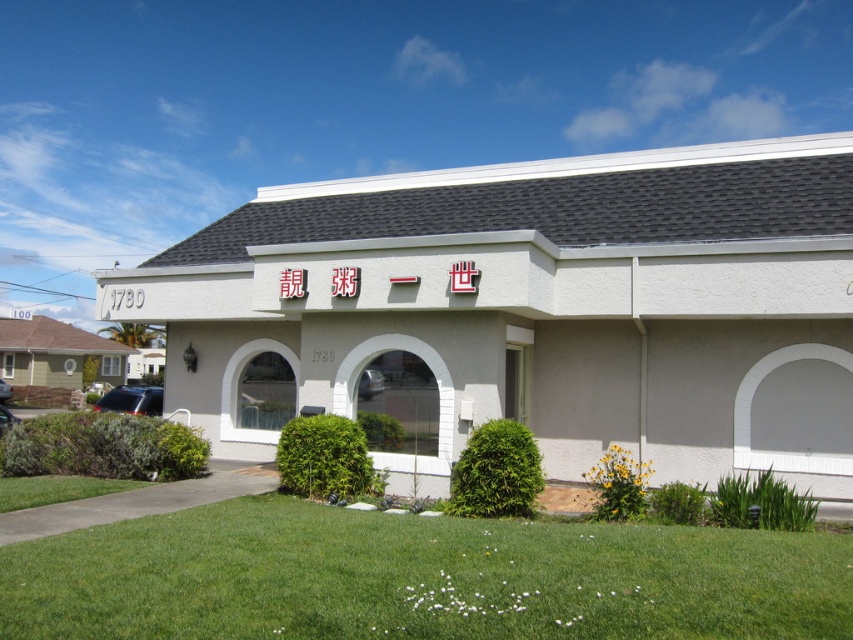
Question: Does white stucco building at center have a greater width compared to green grass at lower center?

Choices:
 (A) no
 (B) yes

Answer: (B)

Question: From the image, what is the correct spatial relationship of white stucco building at center in relation to green grass at lower center?

Choices:
 (A) above
 (B) below

Answer: (A)

Question: Which of the following is the farthest from the observer?

Choices:
 (A) (456, 170)
 (B) (33, 563)

Answer: (A)

Question: From the image, what is the correct spatial relationship of white stucco building at center in relation to green grass at lower center?

Choices:
 (A) below
 (B) above

Answer: (B)

Question: Which of the following is the closest to the observer?

Choices:
 (A) (665, 618)
 (B) (334, 333)

Answer: (A)

Question: Which of the following is the closest to the observer?

Choices:
 (A) white stucco building at center
 (B) green grass at lower center

Answer: (B)